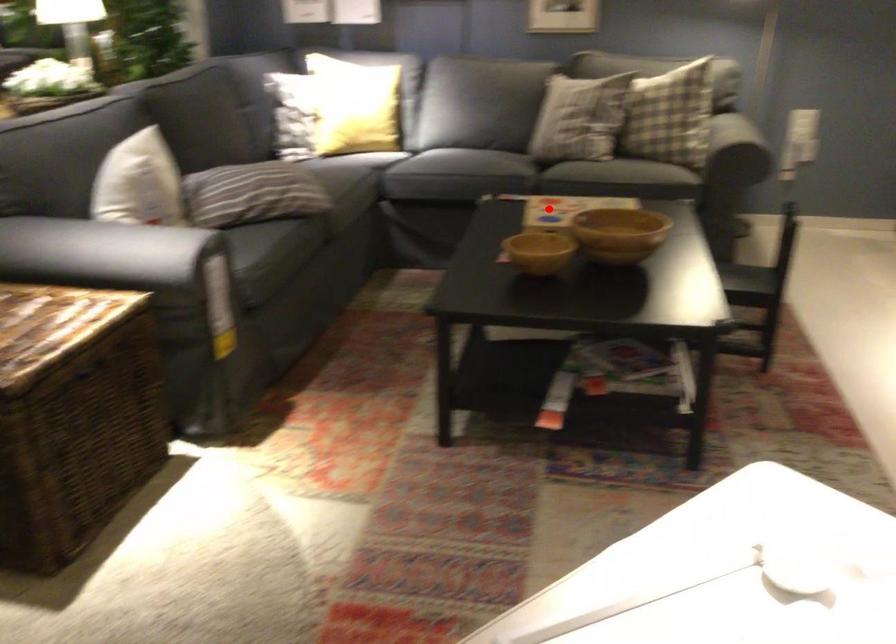
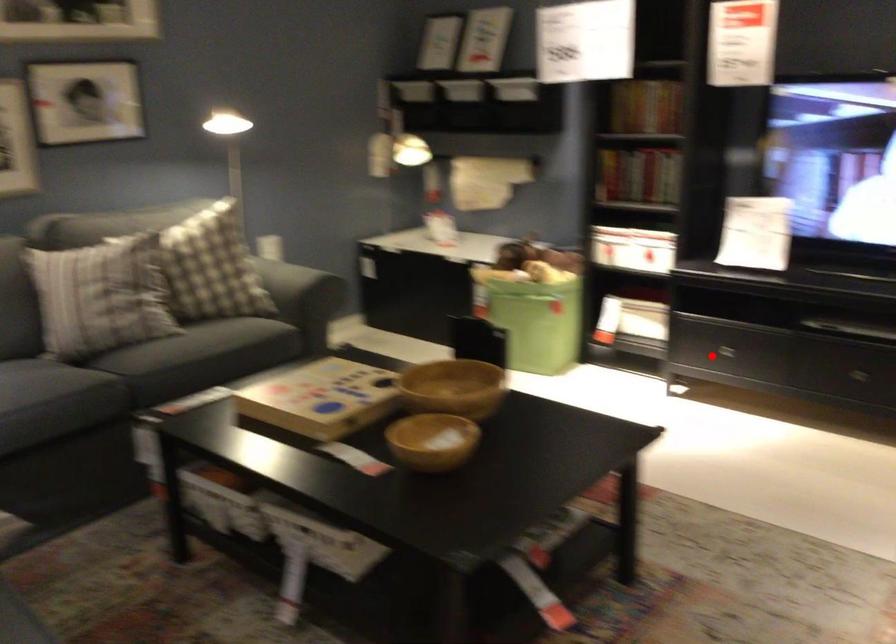
I am providing you with two images of the same scene from different viewpoints. A red point is marked on the first image and another point is marked on the second image. Do the highlighted points in image1 and image2 indicate the same real-world spot?

No